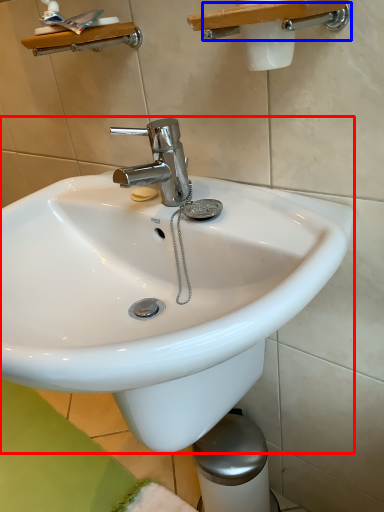
Question: Which object appears farthest to the camera in this image, sink (highlighted by a red box) or shower (highlighted by a blue box)?

Choices:
 (A) sink
 (B) shower

Answer: (B)